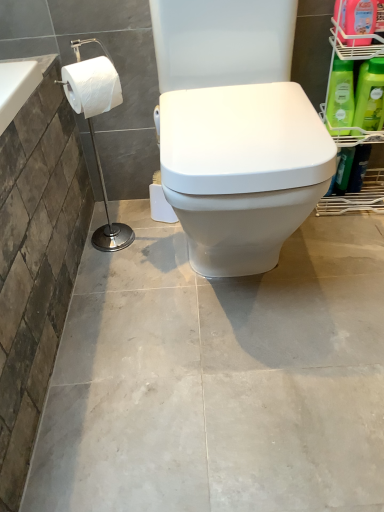
Question: Is green matte bottle at right, the first cleaning product from the bottom, wider than green plastic shelf at right?

Choices:
 (A) no
 (B) yes

Answer: (A)

Question: Considering the relative sizes of green matte bottle at right, positioned as the third cleaning product in top-to-bottom order, and green plastic shelf at right in the image provided, is green matte bottle at right, positioned as the third cleaning product in top-to-bottom order, smaller than green plastic shelf at right?

Choices:
 (A) yes
 (B) no

Answer: (A)

Question: Is green matte bottle at right, positioned as the third cleaning product in top-to-bottom order, located outside green plastic shelf at right?

Choices:
 (A) no
 (B) yes

Answer: (A)

Question: From a real-world perspective, is green matte bottle at right, the first cleaning product from the bottom, on top of green plastic shelf at right?

Choices:
 (A) yes
 (B) no

Answer: (A)

Question: Is green matte bottle at right, the first cleaning product from the bottom, closer to camera compared to green plastic shelf at right?

Choices:
 (A) no
 (B) yes

Answer: (A)

Question: Is green matte bottle at right, positioned as the third cleaning product in top-to-bottom order, thinner than green plastic shelf at right?

Choices:
 (A) yes
 (B) no

Answer: (A)

Question: Is white paper towel at left facing towards green matte bottle at right, positioned as the third cleaning product in top-to-bottom order?

Choices:
 (A) no
 (B) yes

Answer: (A)

Question: Is white paper towel at left not within green matte bottle at right, positioned as the third cleaning product in top-to-bottom order?

Choices:
 (A) no
 (B) yes

Answer: (B)

Question: Considering the relative sizes of white paper towel at left and green matte bottle at right, the first cleaning product from the bottom, in the image provided, is white paper towel at left taller than green matte bottle at right, the first cleaning product from the bottom,?

Choices:
 (A) yes
 (B) no

Answer: (A)

Question: Is white paper towel at left smaller than green matte bottle at right, positioned as the third cleaning product in top-to-bottom order?

Choices:
 (A) yes
 (B) no

Answer: (B)

Question: Would you say white paper towel at left contains green matte bottle at right, the first cleaning product from the bottom?

Choices:
 (A) no
 (B) yes

Answer: (A)

Question: From a real-world perspective, is white paper towel at left beneath green matte bottle at right, the first cleaning product from the bottom?

Choices:
 (A) yes
 (B) no

Answer: (A)

Question: Considering the relative positions of white matte toilet paper at left and green matte bottle at right, positioned as the third cleaning product in top-to-bottom order, in the image provided, is white matte toilet paper at left to the left of green matte bottle at right, positioned as the third cleaning product in top-to-bottom order, from the viewer's perspective?

Choices:
 (A) yes
 (B) no

Answer: (A)